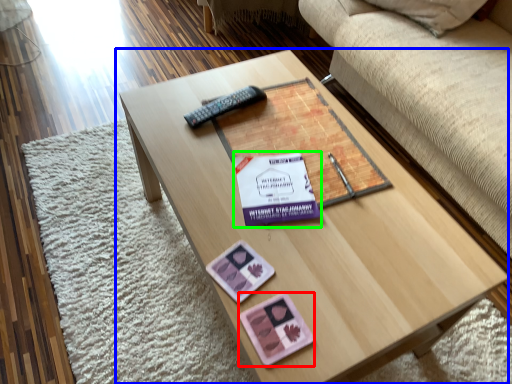
Question: Which object is positioned closest to currency (highlighted by a red box)? Select from coffee table (highlighted by a blue box) and paperback book (highlighted by a green box).

Choices:
 (A) coffee table
 (B) paperback book

Answer: (B)